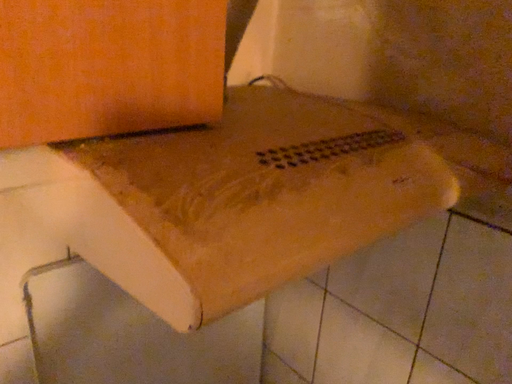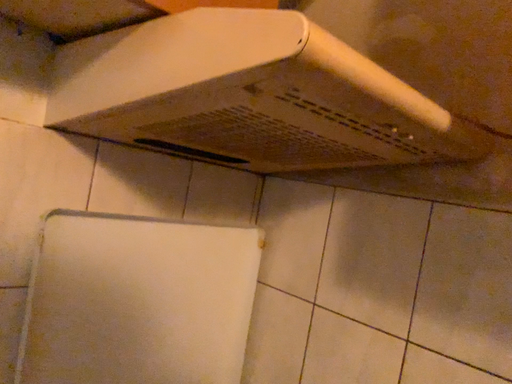
Question: How did the camera likely rotate when shooting the video?

Choices:
 (A) rotated upward
 (B) rotated downward

Answer: (A)